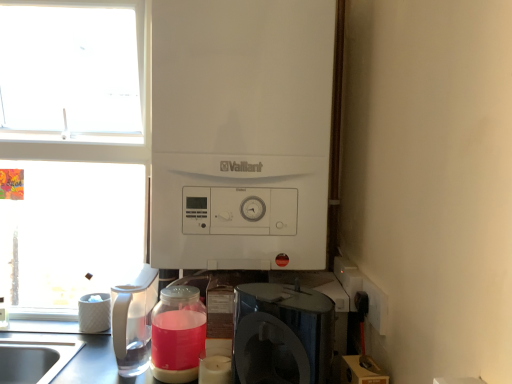
This screenshot has width=512, height=384. Describe the element at coordinates (94, 313) in the screenshot. I see `white textured container at left, the first appliance when ordered from back to front` at that location.

Where is `translucent glass jar at center`? translucent glass jar at center is located at coordinates (177, 334).

What do you see at coordinates (70, 148) in the screenshot? The height and width of the screenshot is (384, 512). I see `white matte window at upper left` at bounding box center [70, 148].

Measure the distance between white matte boiler at center, which appears as the second appliance when viewed from the left, and camera.

The distance of white matte boiler at center, which appears as the second appliance when viewed from the left, from camera is 38.85 inches.

Describe the element at coordinates (282, 334) in the screenshot. This screenshot has width=512, height=384. I see `satin black coffee maker at lower center` at that location.

The image size is (512, 384). Describe the element at coordinates (376, 305) in the screenshot. I see `white plastic electric outlet at lower right` at that location.

The width and height of the screenshot is (512, 384). Identify the location of white textured container at left, the second appliance in the right-to-left sequence. (94, 313).

From the image's perspective, does satin black coffee maker at lower center appear higher than white matte boiler at center, the second appliance positioned from the back?

Incorrect, from the image's perspective, satin black coffee maker at lower center is lower than white matte boiler at center, the second appliance positioned from the back.

Is satin black coffee maker at lower center not within white matte boiler at center, which is the second appliance from bottom to top?

Yes, satin black coffee maker at lower center is outside of white matte boiler at center, which is the second appliance from bottom to top.

Considering the sizes of satin black coffee maker at lower center and white matte boiler at center, which is the 1th appliance in top-to-bottom order, in the image, is satin black coffee maker at lower center taller or shorter than white matte boiler at center, which is the 1th appliance in top-to-bottom order,?

Considering their sizes, satin black coffee maker at lower center has less height than white matte boiler at center, which is the 1th appliance in top-to-bottom order.

From the image's perspective, is white matte window at upper left below white plastic electric outlet at lower right?

No.

Can you confirm if white matte window at upper left is thinner than white plastic electric outlet at lower right?

No, white matte window at upper left is not thinner than white plastic electric outlet at lower right.

Is white matte window at upper left turned away from white plastic electric outlet at lower right?

That's not correct — white matte window at upper left is not looking away from white plastic electric outlet at lower right.

Which is behind, white plastic electric outlet at lower right or clear plastic pitcher at left?

clear plastic pitcher at left is more distant.

Can you confirm if white plastic electric outlet at lower right is smaller than clear plastic pitcher at left?

Indeed, white plastic electric outlet at lower right has a smaller size compared to clear plastic pitcher at left.

Can you tell me how much white plastic electric outlet at lower right and clear plastic pitcher at left differ in facing direction?

The facing directions of white plastic electric outlet at lower right and clear plastic pitcher at left are 90 degrees apart.

Is white plastic electric outlet at lower right completely or partially outside of clear plastic pitcher at left?

white plastic electric outlet at lower right is positioned outside clear plastic pitcher at left.

From a real-world perspective, is white textured container at left, the first appliance when ordered from back to front, positioned under white matte window at upper left based on gravity?

Yes, from a real-world perspective, white textured container at left, the first appliance when ordered from back to front, is below white matte window at upper left.

Considering the positions of objects white textured container at left, marked as the 1th appliance in a bottom-to-top arrangement, and white matte window at upper left in the image provided, who is more to the right, white textured container at left, marked as the 1th appliance in a bottom-to-top arrangement, or white matte window at upper left?

Positioned to the right is white textured container at left, marked as the 1th appliance in a bottom-to-top arrangement.

Is white matte window at upper left inside white textured container at left, the second appliance in the right-to-left sequence?

Definitely not — white matte window at upper left is not inside white textured container at left, the second appliance in the right-to-left sequence.

Is white textured container at left, the 2th appliance in the front-to-back sequence, touching white matte window at upper left?

white textured container at left, the 2th appliance in the front-to-back sequence, and white matte window at upper left are clearly separated.

Is point (248, 48) closer or farther from the camera than point (160, 304)?

Point (248, 48) appears to be closer to the viewer than point (160, 304).

At what (x,y) coordinates should I click in order to perform the action: click on bottle below the white matte boiler at center, the 1th appliance in the right-to-left sequence (from the image's perspective). Please return your answer as a coordinate pair (x, y). Image resolution: width=512 pixels, height=384 pixels. Looking at the image, I should click on (177, 334).

Based on the photo, is white matte boiler at center, which is the second appliance from bottom to top, turned away from translucent glass jar at center?

No, white matte boiler at center, which is the second appliance from bottom to top, is not facing the opposite direction of translucent glass jar at center.

Can you confirm if white matte boiler at center, which appears as the second appliance when viewed from the left, is bigger than translucent glass jar at center?

Correct, white matte boiler at center, which appears as the second appliance when viewed from the left, is larger in size than translucent glass jar at center.

From the image's perspective, between white matte boiler at center, which is the 1th appliance from front to back, and satin black coffee maker at lower center, which one is located above?

white matte boiler at center, which is the 1th appliance from front to back, from the image's perspective.

Is white matte boiler at center, which is the 1th appliance in top-to-bottom order, not within satin black coffee maker at lower center?

Absolutely, white matte boiler at center, which is the 1th appliance in top-to-bottom order, is external to satin black coffee maker at lower center.

This screenshot has width=512, height=384. In order to click on appliance above the satin black coffee maker at lower center (from a real-world perspective) in this screenshot , I will do `click(241, 133)`.

Who is more distant, white matte boiler at center, which is the 1th appliance from front to back, or satin black coffee maker at lower center?

white matte boiler at center, which is the 1th appliance from front to back, is behind.

Can you confirm if translucent glass jar at center is smaller than satin black coffee maker at lower center?

Indeed, translucent glass jar at center has a smaller size compared to satin black coffee maker at lower center.

How different are the orientations of translucent glass jar at center and satin black coffee maker at lower center in degrees?

The angle between the facing direction of translucent glass jar at center and the facing direction of satin black coffee maker at lower center is 43 degrees.

Does translucent glass jar at center have a lesser width compared to satin black coffee maker at lower center?

Incorrect, the width of translucent glass jar at center is not less than that of satin black coffee maker at lower center.

Is the depth of translucent glass jar at center less than that of satin black coffee maker at lower center?

No.

Image resolution: width=512 pixels, height=384 pixels. What are the coordinates of `home appliance on the right of the white matte boiler at center, which appears as the second appliance when viewed from the left` in the screenshot? It's located at (282, 334).

The width and height of the screenshot is (512, 384). I want to click on window behind the white plastic electric outlet at lower right, so click(x=70, y=148).

Based on their spatial positions, is clear plastic pitcher at left or translucent glass jar at center further from satin black coffee maker at lower center?

A: clear plastic pitcher at left is further to satin black coffee maker at lower center.

Which object lies further to the anchor point translucent glass jar at center, clear plastic pitcher at left or satin black coffee maker at lower center?

satin black coffee maker at lower center is positioned further to the anchor translucent glass jar at center.

Considering their positions, is white matte boiler at center, the 1th appliance in the right-to-left sequence, positioned further to white plastic electric outlet at lower right than white textured container at left, the first appliance in the left-to-right sequence?

white textured container at left, the first appliance in the left-to-right sequence, is positioned further to the anchor white plastic electric outlet at lower right.

Based on their spatial positions, is clear plastic pitcher at left or satin black coffee maker at lower center further from white matte boiler at center, which appears as the second appliance when viewed from the left?

clear plastic pitcher at left is further to white matte boiler at center, which appears as the second appliance when viewed from the left.

Based on their spatial positions, is white matte window at upper left or white textured container at left, the first appliance when ordered from back to front, closer to satin black coffee maker at lower center?

The object closer to satin black coffee maker at lower center is white textured container at left, the first appliance when ordered from back to front.

Looking at the image, which one is located closer to white matte boiler at center, which appears as the second appliance when viewed from the left, white matte window at upper left or white textured container at left, the 2th appliance in the front-to-back sequence?

white matte window at upper left is closer to white matte boiler at center, which appears as the second appliance when viewed from the left.

In the scene shown: Estimate the real-world distances between objects in this image. Which object is closer to clear plastic pitcher at left, translucent glass jar at center or white plastic electric outlet at lower right?

The object closer to clear plastic pitcher at left is translucent glass jar at center.

When comparing their distances from clear plastic pitcher at left, does translucent glass jar at center or white textured container at left, marked as the 1th appliance in a bottom-to-top arrangement, seem closer?

Among the two, translucent glass jar at center is located nearer to clear plastic pitcher at left.

You are a GUI agent. You are given a task and a screenshot of the screen. Output one action in this format:
    pyautogui.click(x=<x>, y=<y>)
    Task: Click on the kitchen appliance between white matte window at upper left and white textured container at left, the first appliance when ordered from back to front, in the vertical direction
    
    Given the screenshot: What is the action you would take?
    pyautogui.click(x=133, y=317)

Find the location of a particular element. This screenshot has height=384, width=512. bottle between white matte window at upper left and white plastic electric outlet at lower right in the horizontal direction is located at coordinates (177, 334).

The height and width of the screenshot is (384, 512). I want to click on bottle situated between white matte window at upper left and satin black coffee maker at lower center from left to right, so click(177, 334).

In order to click on kitchen appliance between satin black coffee maker at lower center and white textured container at left, the 2th appliance when ordered from top to bottom, from front to back in this screenshot , I will do `click(133, 317)`.